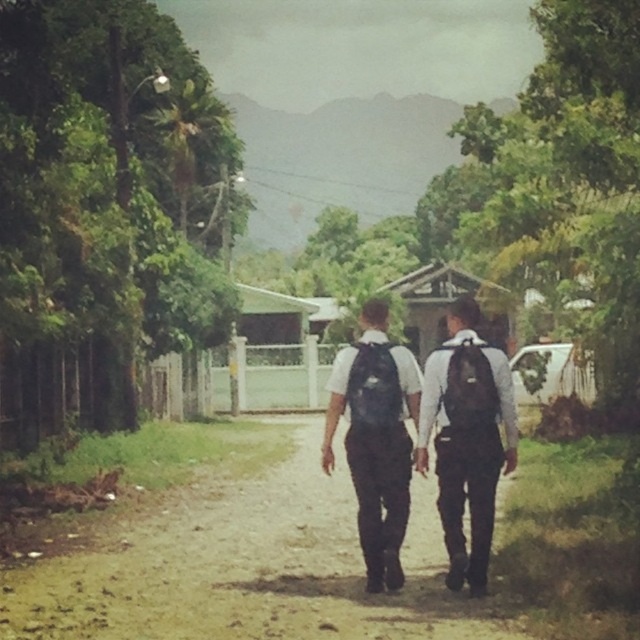
Question: Is brown dirt track at center thinner than black matte backpacks at center?

Choices:
 (A) no
 (B) yes

Answer: (A)

Question: Which point appears closest to the camera in this image?

Choices:
 (A) (451, 419)
 (B) (285, 604)

Answer: (A)

Question: Among these objects, which one is farthest from the camera?

Choices:
 (A) black matte backpacks at center
 (B) brown dirt track at center

Answer: (A)

Question: Which point is farther to the camera?

Choices:
 (A) brown dirt track at center
 (B) black matte backpacks at center

Answer: (B)

Question: Does brown dirt track at center have a larger size compared to black matte backpacks at center?

Choices:
 (A) no
 (B) yes

Answer: (B)

Question: In this image, where is brown dirt track at center located relative to black matte backpacks at center?

Choices:
 (A) below
 (B) above

Answer: (A)